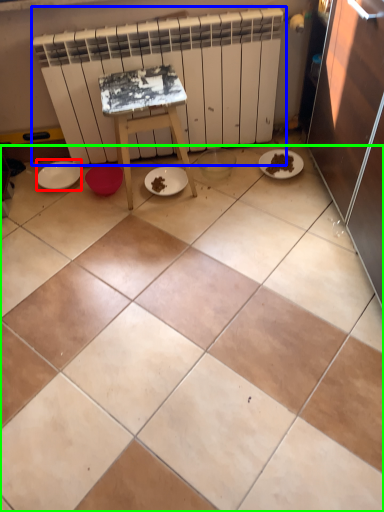
Question: Which object is positioned farthest from paper plate (highlighted by a red box)? Select from radiator (highlighted by a blue box) and ceramic tile (highlighted by a green box).

Choices:
 (A) radiator
 (B) ceramic tile

Answer: (B)